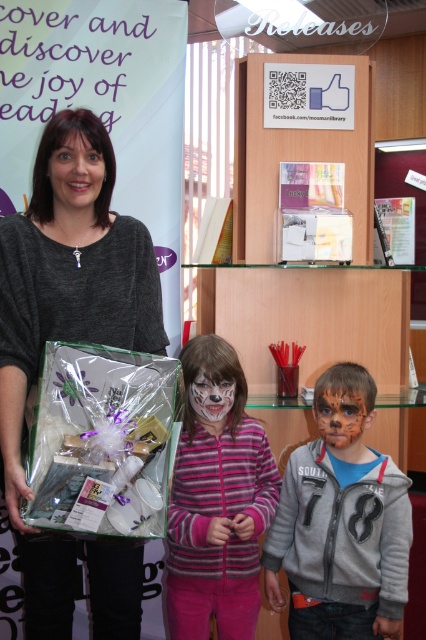
Image resolution: width=426 pixels, height=640 pixels. Identify the location of matte gray hoodie at center. (340, 522).

Is point (325, 609) closer to camera compared to point (348, 397)?

No, (325, 609) is behind (348, 397).

Is point (336, 534) positioned behind point (328, 445)?

No, (336, 534) is in front of (328, 445).

In order to click on matte gray hoodie at center in this screenshot , I will do `click(340, 522)`.

Does matte black sweater at upper left come in front of pink striped sweater at center?

Yes, matte black sweater at upper left is in front of pink striped sweater at center.

Who is more distant from viewer, (98, 209) or (221, 369)?

Point (221, 369)

This screenshot has height=640, width=426. I want to click on matte black sweater at upper left, so click(x=65, y=333).

From the picture: Does matte black sweater at upper left appear under white matte face paint at center?

Incorrect, matte black sweater at upper left is not positioned below white matte face paint at center.

Between point (143, 305) and point (198, 403), which one is positioned in front?

Point (143, 305)

This screenshot has height=640, width=426. What do you see at coordinates (65, 333) in the screenshot?
I see `matte black sweater at upper left` at bounding box center [65, 333].

Where is `matte black sweater at upper left`? matte black sweater at upper left is located at coordinates (65, 333).